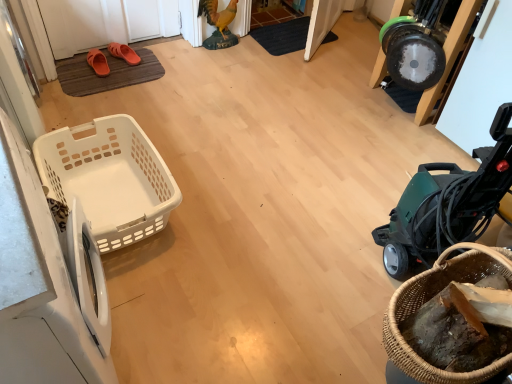
This screenshot has height=384, width=512. Identify the location of free space behind green plastic vacuum cleaner at right. (369, 190).